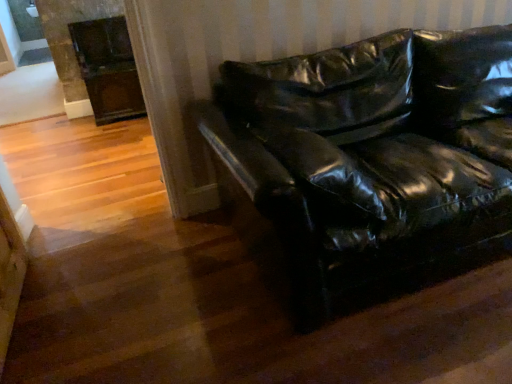
You are a GUI agent. You are given a task and a screenshot of the screen. Output one action in this format:
    pyautogui.click(x=<x>, y=<y>)
    Task: Click on the black leather couch at center
    Image resolution: width=512 pixels, height=384 pixels.
    Given the screenshot: What is the action you would take?
    pyautogui.click(x=372, y=153)

This screenshot has width=512, height=384. Describe the element at coordinates (372, 153) in the screenshot. I see `black leather couch at center` at that location.

This screenshot has height=384, width=512. Find the location of `dark brown wood fireplace at upper left`. dark brown wood fireplace at upper left is located at coordinates [91, 55].

This screenshot has width=512, height=384. Describe the element at coordinates (91, 55) in the screenshot. I see `dark brown wood fireplace at upper left` at that location.

At what (x,y) coordinates should I click in order to perform the action: click on black leather couch at center. Please return your answer as a coordinate pair (x, y). Looking at the image, I should click on (372, 153).

Considering the relative positions of dark brown wood fireplace at upper left and black leather couch at center in the image provided, is dark brown wood fireplace at upper left to the left or to the right of black leather couch at center?

Clearly, dark brown wood fireplace at upper left is on the left of black leather couch at center in the image.

Considering their positions, is dark brown wood fireplace at upper left located in front of or behind black leather couch at center?

Clearly, dark brown wood fireplace at upper left is behind black leather couch at center.

Does point (59, 12) come in front of point (501, 219)?

That is False.

From the image's perspective, is dark brown wood fireplace at upper left above or below black leather couch at center?

Clearly, from the image's perspective, dark brown wood fireplace at upper left is above black leather couch at center.

From a real-world perspective, is dark brown wood fireplace at upper left over black leather couch at center?

Actually, dark brown wood fireplace at upper left is physically below black leather couch at center in the real world.

Which object is wider, dark brown wood fireplace at upper left or black leather couch at center?

black leather couch at center.

Between dark brown wood fireplace at upper left and black leather couch at center, which one has more height?

Standing taller between the two is dark brown wood fireplace at upper left.

Who is bigger, dark brown wood fireplace at upper left or black leather couch at center?

black leather couch at center.

Is dark brown wood fireplace at upper left not inside black leather couch at center?

dark brown wood fireplace at upper left lies outside black leather couch at center's area.

Are dark brown wood fireplace at upper left and black leather couch at center located far from each other?

dark brown wood fireplace at upper left is positioned a significant distance from black leather couch at center.

Is dark brown wood fireplace at upper left turned away from black leather couch at center?

dark brown wood fireplace at upper left does not have its back to black leather couch at center.

Can you tell me how much dark brown wood fireplace at upper left and black leather couch at center differ in facing direction?

0.593 degrees separate the facing orientations of dark brown wood fireplace at upper left and black leather couch at center.

In order to click on fireplace located behind the black leather couch at center in this screenshot , I will do `click(91, 55)`.

Is black leather couch at center to the left of dark brown wood fireplace at upper left from the viewer's perspective?

In fact, black leather couch at center is to the right of dark brown wood fireplace at upper left.

Is the depth of black leather couch at center greater than that of dark brown wood fireplace at upper left?

That is False.

Which is in front, point (406, 58) or point (87, 3)?

The point (406, 58) is more forward.

From the image's perspective, which is below, black leather couch at center or dark brown wood fireplace at upper left?

black leather couch at center.

From a real-world perspective, who is located higher, black leather couch at center or dark brown wood fireplace at upper left?

black leather couch at center.

Is black leather couch at center thinner than dark brown wood fireplace at upper left?

Incorrect, the width of black leather couch at center is not less than that of dark brown wood fireplace at upper left.

Based on the photo, is black leather couch at center taller than dark brown wood fireplace at upper left?

No, black leather couch at center is not taller than dark brown wood fireplace at upper left.

Can you confirm if black leather couch at center is bigger than dark brown wood fireplace at upper left?

Correct, black leather couch at center is larger in size than dark brown wood fireplace at upper left.

Is dark brown wood fireplace at upper left completely or partially inside black leather couch at center?

No, black leather couch at center does not contain dark brown wood fireplace at upper left.

Is black leather couch at center far from dark brown wood fireplace at upper left?

Yes.

Is black leather couch at center turned away from dark brown wood fireplace at upper left?

That's right, black leather couch at center is facing away from dark brown wood fireplace at upper left.

From the picture: How different are the orientations of black leather couch at center and dark brown wood fireplace at upper left in degrees?

They differ by 0.593 degrees in their facing directions.

Find the location of a particular element. The height and width of the screenshot is (384, 512). fireplace that is above the black leather couch at center (from the image's perspective) is located at coordinates (91, 55).

In the image, there is a black leather couch at center. Identify the location of fireplace above it (from the image's perspective). The width and height of the screenshot is (512, 384). (91, 55).

This screenshot has height=384, width=512. Find the location of `studio couch below the dark brown wood fireplace at upper left (from the image's perspective)`. studio couch below the dark brown wood fireplace at upper left (from the image's perspective) is located at coordinates (372, 153).